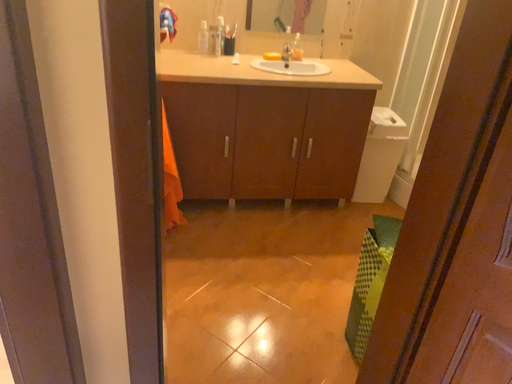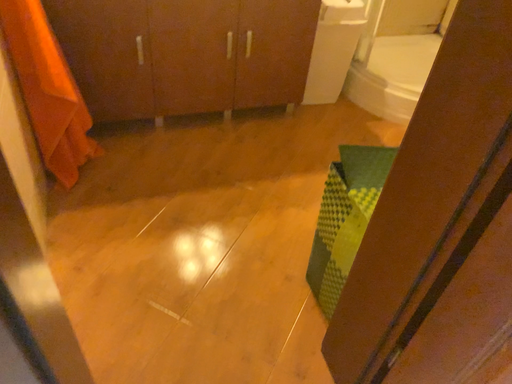
Question: Which way did the camera rotate in the video?

Choices:
 (A) rotated right
 (B) rotated left

Answer: (A)